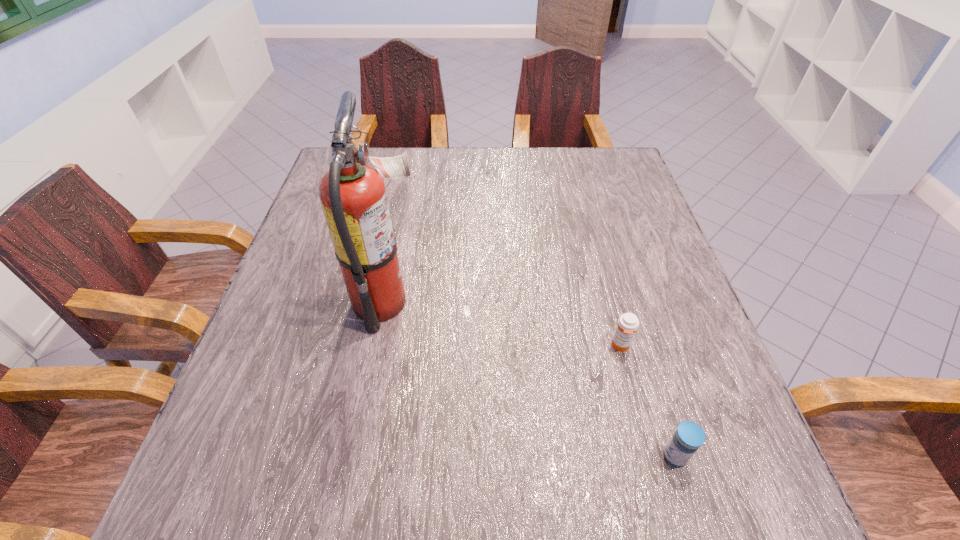
Image resolution: width=960 pixels, height=540 pixels. What are the coordinates of `vacant area in the image that satisfies the following two spatial constraints: 1. from the nozzle of the right medicine; 2. on the left side of the fire extinguisher` in the screenshot? It's located at (359, 456).